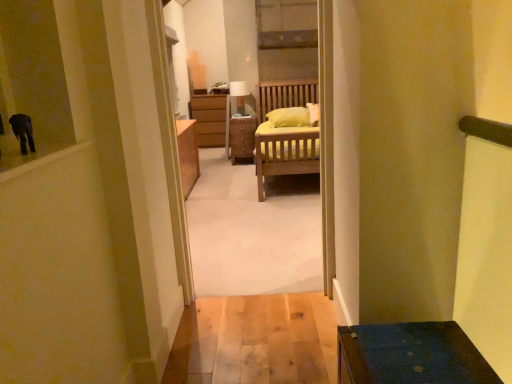
Question: Is wooden nightstand at center not within matte white lamp at center?

Choices:
 (A) no
 (B) yes

Answer: (B)

Question: Is wooden nightstand at center aimed at matte white lamp at center?

Choices:
 (A) no
 (B) yes

Answer: (A)

Question: Is wooden nightstand at center far from matte white lamp at center?

Choices:
 (A) no
 (B) yes

Answer: (A)

Question: Does wooden nightstand at center have a smaller size compared to matte white lamp at center?

Choices:
 (A) no
 (B) yes

Answer: (A)

Question: Can you confirm if wooden nightstand at center is thinner than matte white lamp at center?

Choices:
 (A) yes
 (B) no

Answer: (B)

Question: From the image's perspective, is wooden nightstand at center on top of matte white lamp at center?

Choices:
 (A) yes
 (B) no

Answer: (B)

Question: Can you confirm if wooden bed at center is positioned to the right of wooden nightstand at center?

Choices:
 (A) yes
 (B) no

Answer: (A)

Question: From the image's perspective, does wooden bed at center appear lower than wooden nightstand at center?

Choices:
 (A) no
 (B) yes

Answer: (B)

Question: Does wooden bed at center turn towards wooden nightstand at center?

Choices:
 (A) no
 (B) yes

Answer: (B)

Question: Is wooden bed at center closer to the viewer compared to wooden nightstand at center?

Choices:
 (A) no
 (B) yes

Answer: (B)

Question: Can you see wooden bed at center touching wooden nightstand at center?

Choices:
 (A) no
 (B) yes

Answer: (A)

Question: Considering the relative positions of wooden bed at center and wooden nightstand at center in the image provided, is wooden bed at center to the left of wooden nightstand at center from the viewer's perspective?

Choices:
 (A) no
 (B) yes

Answer: (A)

Question: Is matte white lamp at center at the right side of wooden bed at center?

Choices:
 (A) yes
 (B) no

Answer: (B)